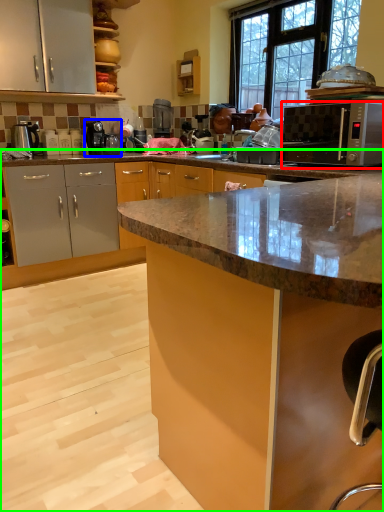
Question: Which object is the farthest from microwave oven (highlighted by a red box)? Choose among these: coffee machine (highlighted by a blue box) or cabinetry (highlighted by a green box).

Choices:
 (A) coffee machine
 (B) cabinetry

Answer: (B)